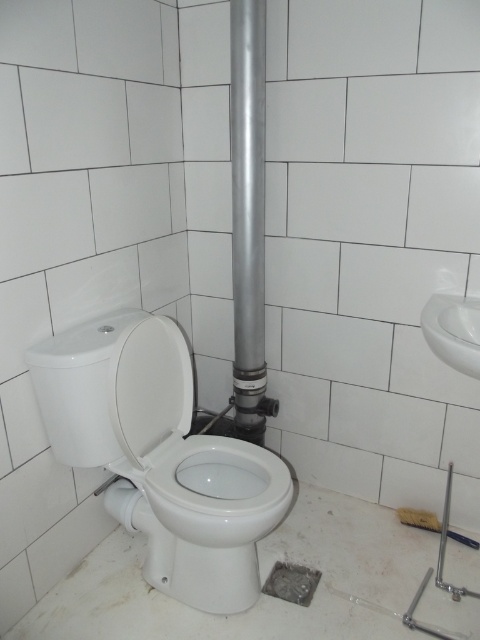
Question: Is the position of white glossy toilet at left less distant than that of white glossy toilet lid at center?

Choices:
 (A) yes
 (B) no

Answer: (A)

Question: Considering the real-world distances, which object is closest to the white glossy toilet lid at center?

Choices:
 (A) white glossy toilet bowl at center
 (B) white glossy sink at right
 (C) white glossy toilet at left

Answer: (C)

Question: Among these points, which one is nearest to the camera?

Choices:
 (A) (157, 512)
 (B) (142, 342)
 (C) (477, 349)
 (D) (250, 260)

Answer: (C)

Question: Does white glossy toilet at left appear on the right side of silver metallic pipe at center?

Choices:
 (A) yes
 (B) no

Answer: (B)

Question: Which point is farther to the camera?

Choices:
 (A) white glossy sink at right
 (B) white glossy toilet lid at center
 (C) white glossy toilet bowl at center

Answer: (B)

Question: Is white glossy toilet bowl at center to the left of white glossy sink at right from the viewer's perspective?

Choices:
 (A) yes
 (B) no

Answer: (A)